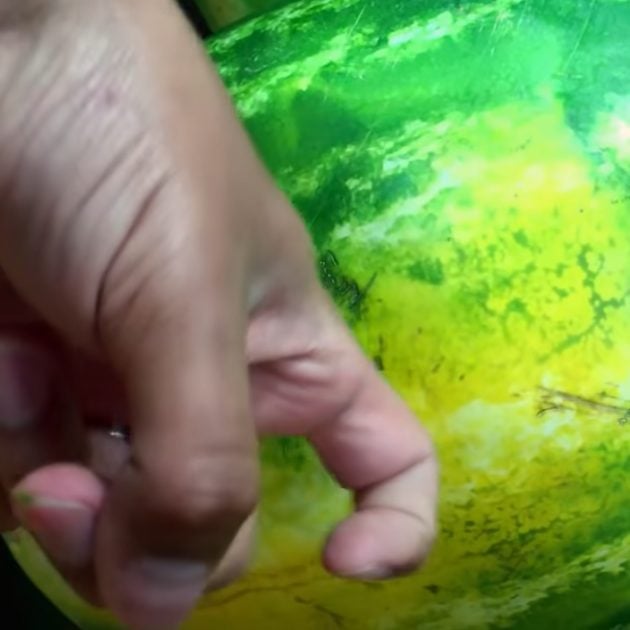
Identify the location of green artwork. (513, 322).